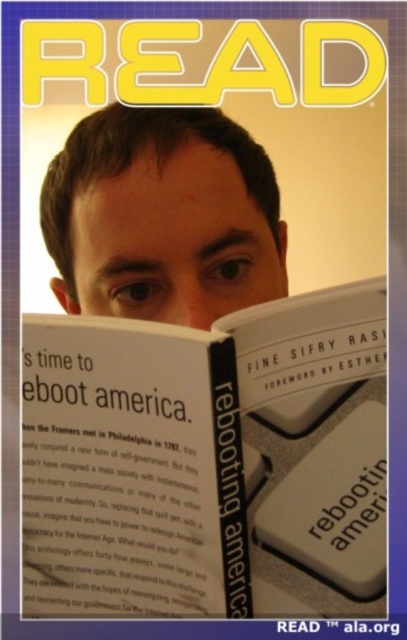
Is white paper book at center smaller than matte skin at center?

Indeed, white paper book at center has a smaller size compared to matte skin at center.

Is white paper book at center taller than matte skin at center?

Indeed, white paper book at center has a greater height compared to matte skin at center.

Is point (260, 474) positioned before point (221, 284)?

Yes, it is.

At what (x,y) coordinates should I click in order to perform the action: click on white paper book at center. Please return your answer as a coordinate pair (x, y). The width and height of the screenshot is (407, 640). Looking at the image, I should click on click(x=207, y=461).